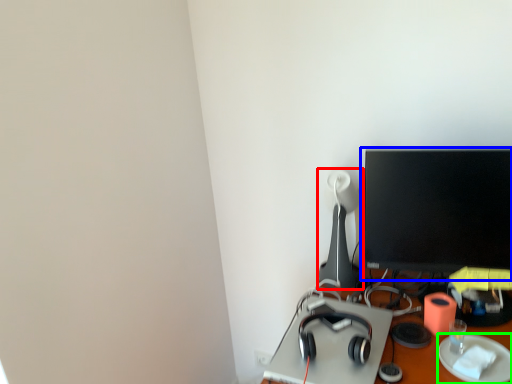
Question: Based on their relative distances, which object is nearer to table lamp (highlighted by a red box)? Choose from computer monitor (highlighted by a blue box) and paper plate (highlighted by a green box).

Choices:
 (A) computer monitor
 (B) paper plate

Answer: (A)